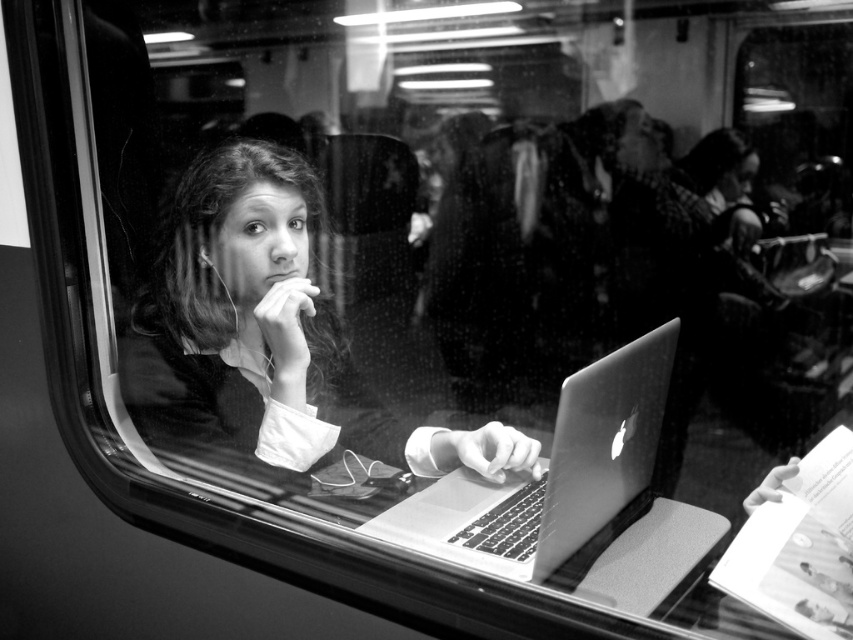
Between smooth skin girl at center and metallic silver laptop at center, which one has more height?

smooth skin girl at center is taller.

Based on the photo, who is lower down, smooth skin girl at center or metallic silver laptop at center?

metallic silver laptop at center

Between point (250, 161) and point (561, 492), which one is positioned behind?

The point (250, 161) is more distant.

Where is `smooth skin girl at center`? The image size is (853, 640). smooth skin girl at center is located at coordinates (268, 332).